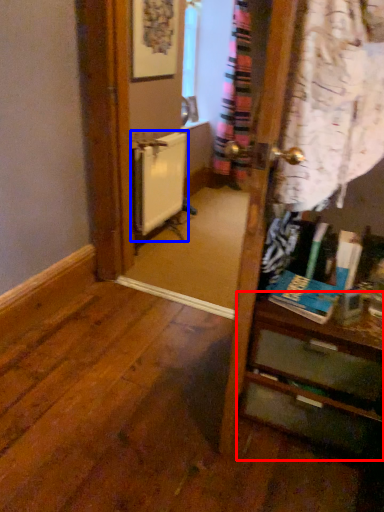
Question: Among these objects, which one is farthest to the camera, vanity (highlighted by a red box) or radiator (highlighted by a blue box)?

Choices:
 (A) vanity
 (B) radiator

Answer: (B)